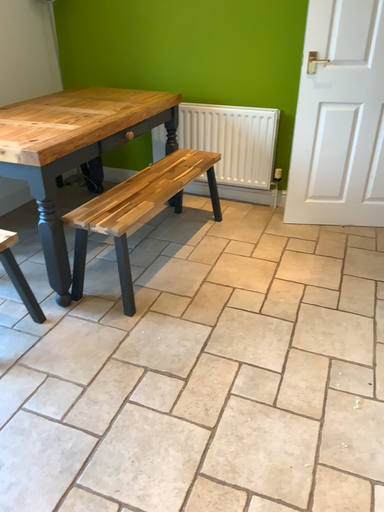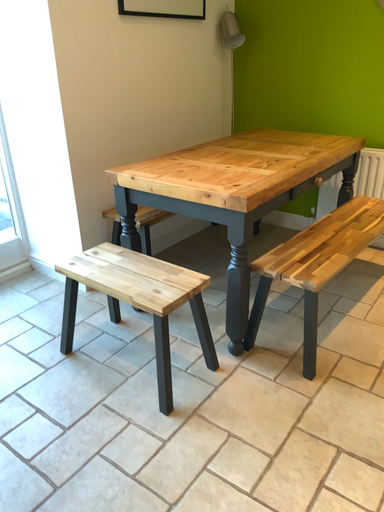
Question: How did the camera likely rotate when shooting the video?

Choices:
 (A) rotated left
 (B) rotated right

Answer: (A)